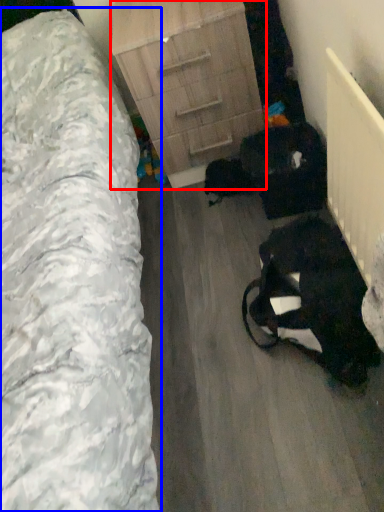
Question: Which point is further to the camera, chest of drawers (highlighted by a red box) or furniture (highlighted by a blue box)?

Choices:
 (A) chest of drawers
 (B) furniture

Answer: (A)